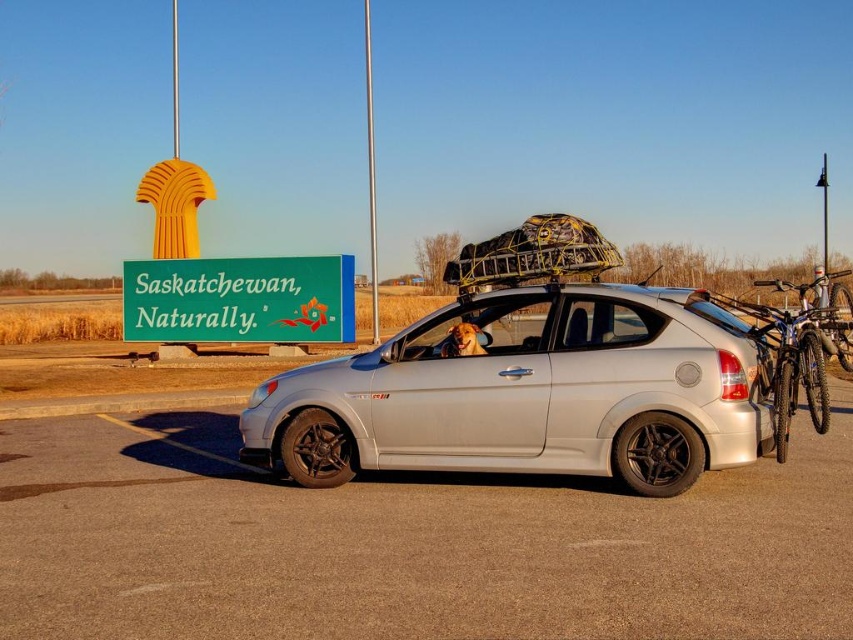
You are standing at the roadside rest area looking at the silver hatchback car. There are two points marked on the car. Which point, point 1 at coordinates (355, 369) or point 2 at coordinates (316, 308), is closer to you?

Point 1 at coordinates (355, 369) is closer to the viewer than point 2 at coordinates (316, 308).

Looking at this image, you are a photographer setting up a shot of the silver metallic hatchback at center and the blue metallic bicycle at right. You want to frame them so that the hatchback is on the left side of the bicycle. Is the current arrangement already set up this way?

Yes, the silver metallic hatchback at center is already positioned to the left of the blue metallic bicycle at right, so the current arrangement meets your framing requirement.